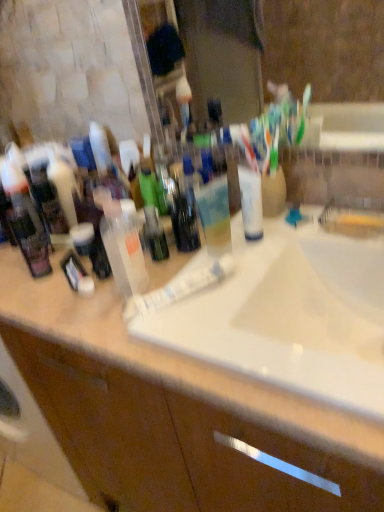
You are a GUI agent. You are given a task and a screenshot of the screen. Output one action in this format:
    pyautogui.click(x=<x>, y=<y>)
    Task: Click on the vacant space in front of translucent plastic spray bottle at center
    This screenshot has height=512, width=384.
    Given the screenshot: What is the action you would take?
    pyautogui.click(x=142, y=349)